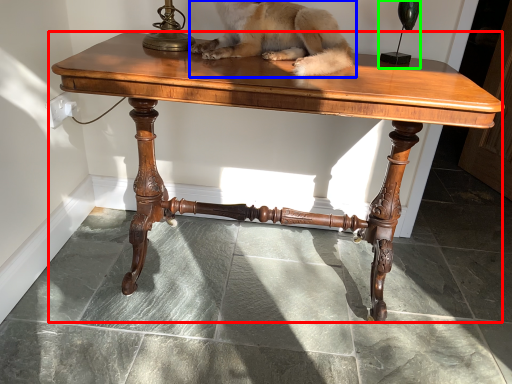
Question: Which is farther away from table (highlighted by a red box)? dog (highlighted by a blue box) or candle holder (highlighted by a green box)?

Choices:
 (A) dog
 (B) candle holder

Answer: (B)